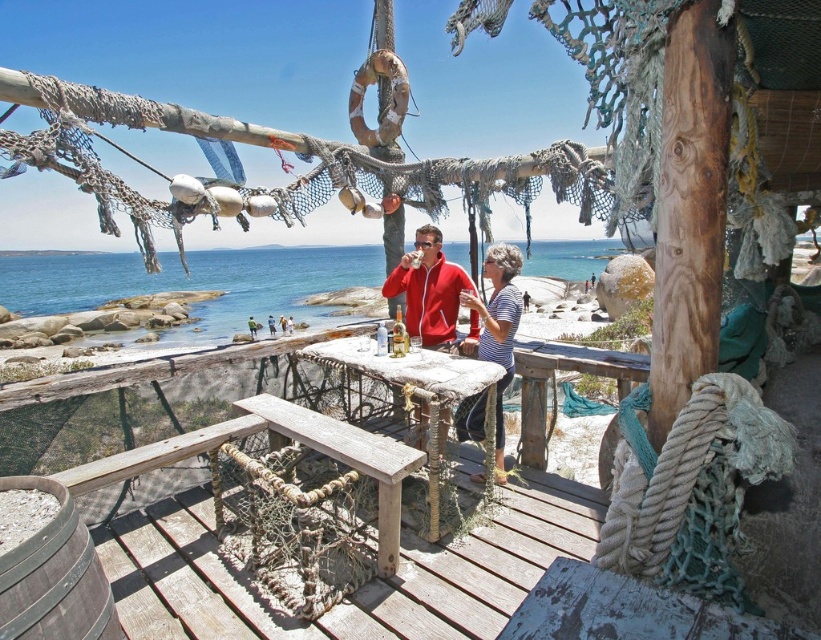
Is wooden bench at center behind wooden table at center?

No.

Between wooden bench at center and wooden table at center, which one appears on the right side from the viewer's perspective?

From the viewer's perspective, wooden table at center appears more on the right side.

Is point (397, 566) in front of point (533, 467)?

Yes, it is.

At what (x,y) coordinates should I click in order to perform the action: click on wooden bench at center. Please return your answer as a coordinate pair (x, y). The image size is (821, 640). Looking at the image, I should click on (347, 458).

Is rustic wood picnic table at center to the left of wooden bench at center from the viewer's perspective?

No, rustic wood picnic table at center is not to the left of wooden bench at center.

Locate an element on the screen. This screenshot has width=821, height=640. rustic wood picnic table at center is located at coordinates (420, 396).

In order to click on rustic wood picnic table at center in this screenshot , I will do `click(420, 396)`.

Can you confirm if striped fabric shirt at center is thinner than wooden table at center?

Correct, striped fabric shirt at center's width is less than wooden table at center's.

Which is behind, point (514, 310) or point (579, 346)?

Positioned behind is point (579, 346).

The height and width of the screenshot is (640, 821). In order to click on striped fabric shirt at center in this screenshot , I will do `click(498, 326)`.